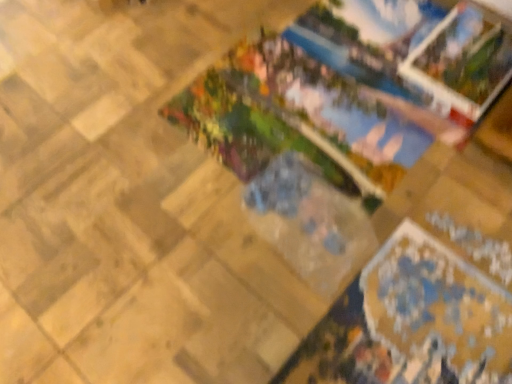
What do you see at coordinates (372, 185) in the screenshot? I see `matte plastic picture frame at center` at bounding box center [372, 185].

Image resolution: width=512 pixels, height=384 pixels. I want to click on matte plastic picture frame at center, so click(372, 185).

Where is `matte plastic picture frame at center`? This screenshot has width=512, height=384. matte plastic picture frame at center is located at coordinates (372, 185).